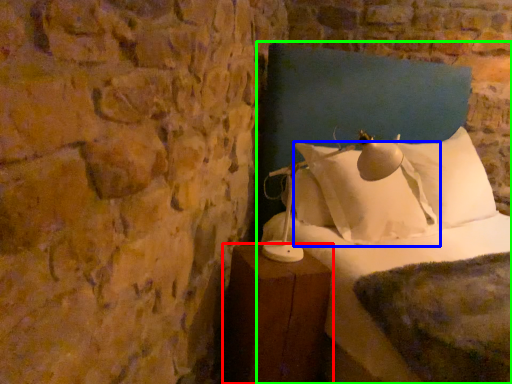
Question: Considering the real-world distances, which object is closest to furniture (highlighted by a red box)? pillow (highlighted by a blue box) or bed (highlighted by a green box).

Choices:
 (A) pillow
 (B) bed

Answer: (B)